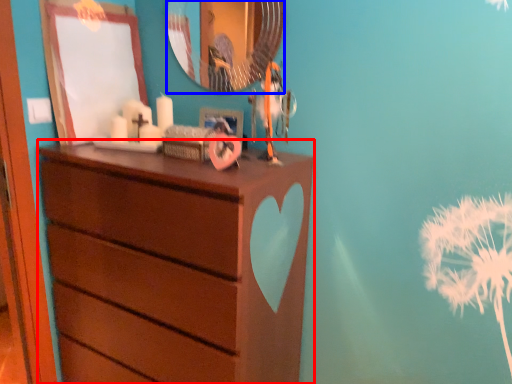
Question: Which object appears farthest to the camera in this image, chest of drawers (highlighted by a red box) or mirror (highlighted by a blue box)?

Choices:
 (A) chest of drawers
 (B) mirror

Answer: (B)